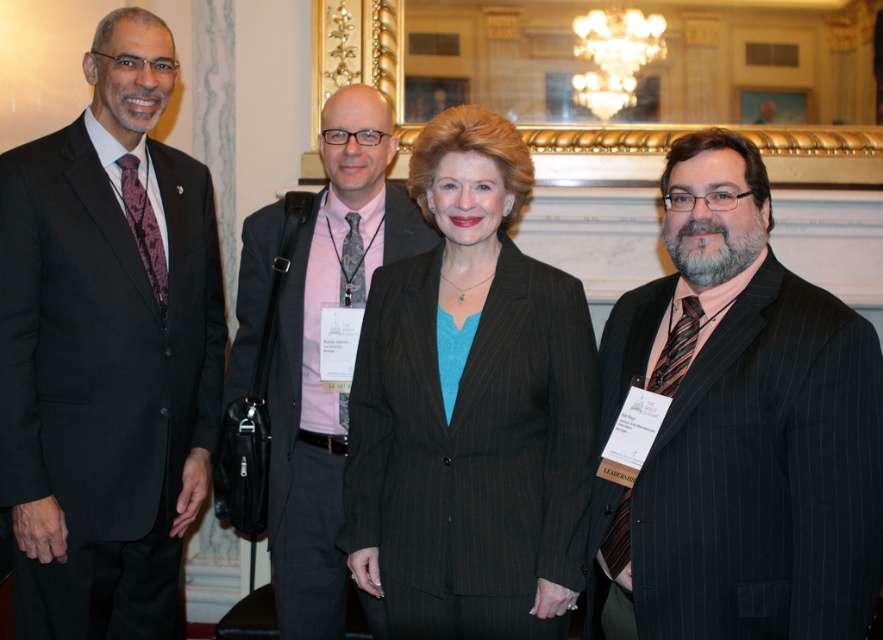
Is matte black suit at left behind matte black suit at right?

Yes, it is.

Is matte black suit at left above matte black suit at right?

Yes.

Between point (155, 104) and point (704, 451), which one is positioned in front?

Point (704, 451) is in front.

Locate an element on the screen. This screenshot has height=640, width=883. matte black suit at left is located at coordinates (107, 349).

Does point (77, 628) come behind point (518, 477)?

Yes.

Which is behind, point (141, 38) or point (455, 432)?

The point (141, 38) is more distant.

Locate an element on the screen. This screenshot has height=640, width=883. matte black suit at left is located at coordinates (107, 349).

Identify the location of matte black suit at left. This screenshot has height=640, width=883. pyautogui.click(x=107, y=349).

Is matte black suit at right to the left of pink fabric shirt at center from the viewer's perspective?

Incorrect, matte black suit at right is not on the left side of pink fabric shirt at center.

The width and height of the screenshot is (883, 640). What do you see at coordinates (738, 429) in the screenshot?
I see `matte black suit at right` at bounding box center [738, 429].

The image size is (883, 640). Identify the location of matte black suit at right. (738, 429).